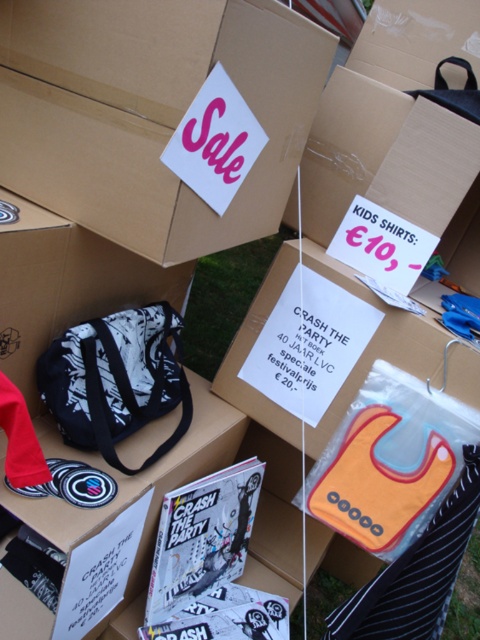
You are a customer at the market and want to find both the matte cardboard box at upper center and the orange fabric bib at lower right. Which item is located to the left of the other?

The matte cardboard box at upper center is positioned on the left side of orange fabric bib at lower right.

What are the coordinates of the matte cardboard box at upper center?

The matte cardboard box at upper center is located at point (151,112).

Consider the image. You are a customer looking at the matte cardboard box at upper center and the black and white fabric bag at center. Which item is positioned closer to you?

The matte cardboard box at upper center is closer to the viewer than the black and white fabric bag at center.